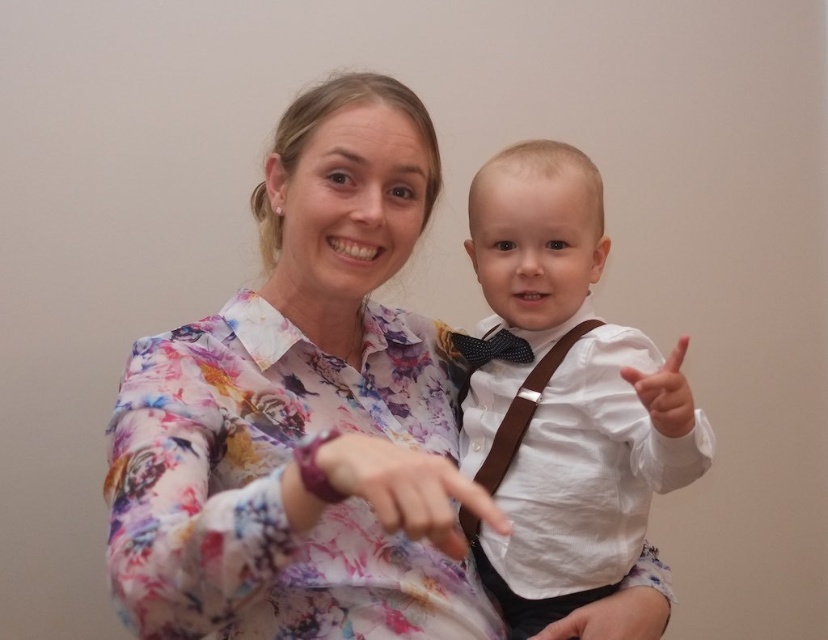
Question: Can you confirm if matte floral shirt at center is bigger than white matte hand at right?

Choices:
 (A) yes
 (B) no

Answer: (B)

Question: Does white matte hand at lower center have a larger size compared to brown leather suspenders at center?

Choices:
 (A) yes
 (B) no

Answer: (B)

Question: Which point is farther from the camera taking this photo?

Choices:
 (A) (449, 522)
 (B) (639, 388)

Answer: (B)

Question: Which of these objects is positioned farthest from the white matte hand at lower center?

Choices:
 (A) white linen shirt at center
 (B) floral print blouse at center

Answer: (B)

Question: Is matte floral shirt at center wider than white matte hand at lower center?

Choices:
 (A) yes
 (B) no

Answer: (B)

Question: Which object is closer to the camera taking this photo?

Choices:
 (A) white linen shirt at center
 (B) black dotted bow tie at center

Answer: (A)